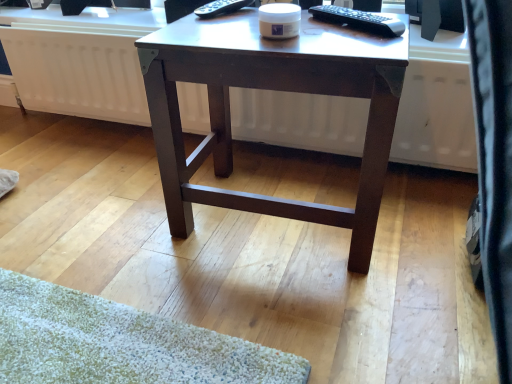
Identify the location of free spot to the left of dark brown wood desk at center. (114, 233).